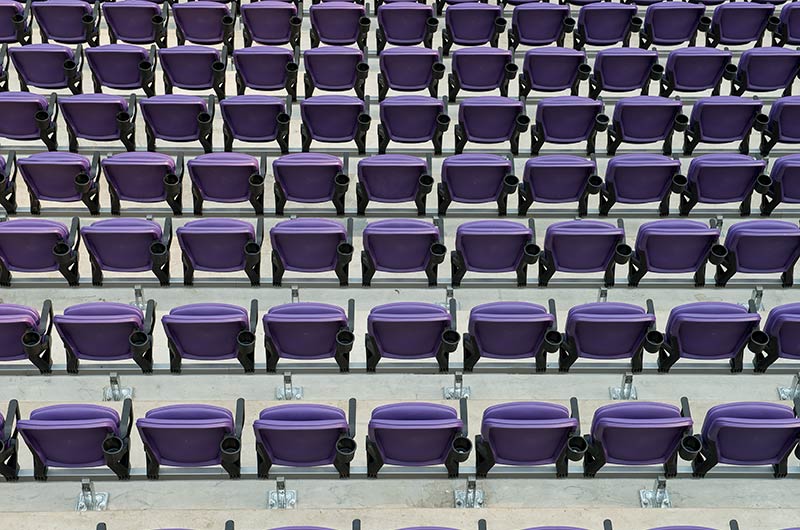
This screenshot has height=530, width=800. In order to click on last row of purple seats in this screenshot , I will do `click(40, 435)`, `click(168, 440)`, `click(298, 437)`, `click(422, 439)`, `click(530, 431)`, `click(646, 445)`, `click(746, 437)`.